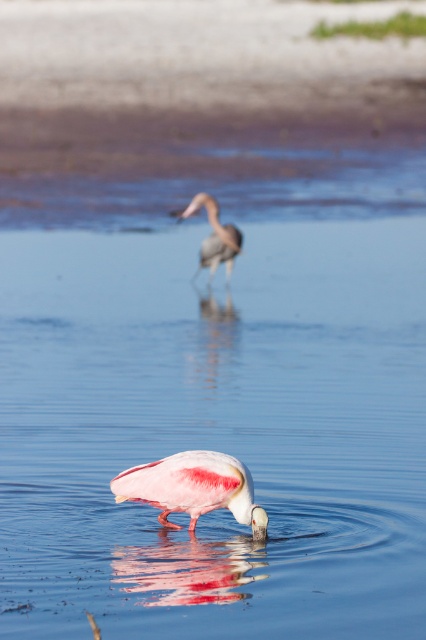
Question: Which object is farther from the camera taking this photo?

Choices:
 (A) pink feathered spoonbill at lower center
 (B) gray matte heron at center

Answer: (B)

Question: Does pink feathered spoonbill at lower center have a greater width compared to gray matte heron at center?

Choices:
 (A) yes
 (B) no

Answer: (A)

Question: Is pink feathered spoonbill at lower center to the left of gray matte heron at center from the viewer's perspective?

Choices:
 (A) yes
 (B) no

Answer: (A)

Question: Which point is farther to the camera?

Choices:
 (A) pink feathered spoonbill at lower center
 (B) gray matte heron at center

Answer: (B)

Question: Is pink feathered spoonbill at lower center below gray matte heron at center?

Choices:
 (A) no
 (B) yes

Answer: (B)